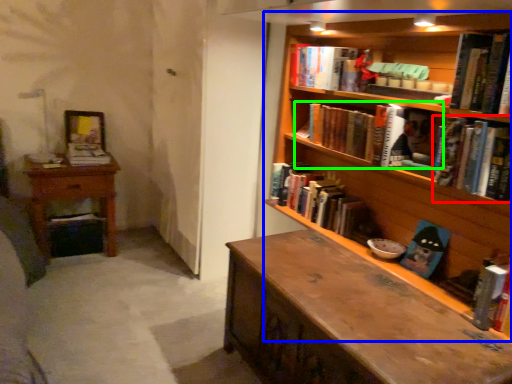
Question: Which object is positioned closest to book (highlighted by a red box)? Select from bookcase (highlighted by a blue box) and book (highlighted by a green box).

Choices:
 (A) bookcase
 (B) book

Answer: (A)